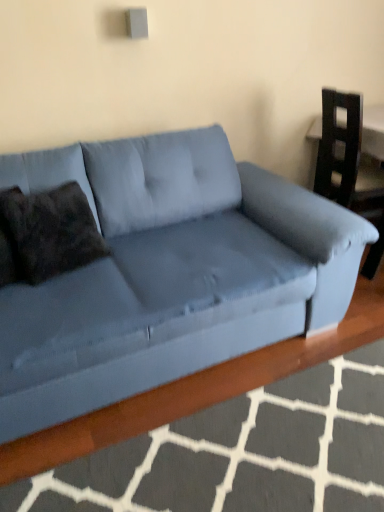
The image size is (384, 512). What do you see at coordinates (168, 273) in the screenshot? I see `velvet blue couch at center` at bounding box center [168, 273].

Describe the element at coordinates (46, 234) in the screenshot. I see `dark brown textured pillow at left` at that location.

Identify the location of matte blue armchair at right. (348, 167).

Considering the relative sizes of dark brown textured pillow at left and velvet blue couch at center in the image provided, is dark brown textured pillow at left bigger than velvet blue couch at center?

Result: Actually, dark brown textured pillow at left might be smaller than velvet blue couch at center.

From a real-world perspective, is dark brown textured pillow at left physically above velvet blue couch at center?

Yes, from a real-world perspective, dark brown textured pillow at left is on top of velvet blue couch at center.

Is point (43, 232) positioned before point (242, 251)?

Yes, it is.

Where is `pillow on the left of the velvet blue couch at center`? The width and height of the screenshot is (384, 512). pillow on the left of the velvet blue couch at center is located at coordinates (46, 234).

Is point (377, 245) positioned after point (13, 240)?

Yes, it is behind point (13, 240).

In terms of width, does matte blue armchair at right look wider or thinner when compared to dark brown textured pillow at left?

Considering their sizes, matte blue armchair at right looks broader than dark brown textured pillow at left.

How distant is matte blue armchair at right from dark brown textured pillow at left?

They are 1.60 meters apart.

From a real-world perspective, is matte blue armchair at right on dark brown textured pillow at left?

No.

In the scene shown: What's the angular difference between velvet blue couch at center and dark brown textured pillow at left's facing directions?

14.4 degrees separate the facing orientations of velvet blue couch at center and dark brown textured pillow at left.

Is velvet blue couch at center at the right side of dark brown textured pillow at left?

Yes, velvet blue couch at center is to the right of dark brown textured pillow at left.

Considering the relative sizes of velvet blue couch at center and dark brown textured pillow at left in the image provided, is velvet blue couch at center shorter than dark brown textured pillow at left?

No.

Would you say dark brown textured pillow at left is inside or outside matte blue armchair at right?

dark brown textured pillow at left is not enclosed by matte blue armchair at right.

Is dark brown textured pillow at left not close to matte blue armchair at right?

Yes, dark brown textured pillow at left is far from matte blue armchair at right.

Is dark brown textured pillow at left shorter than matte blue armchair at right?

Yes.

Does matte blue armchair at right have a greater width compared to velvet blue couch at center?

Incorrect, the width of matte blue armchair at right does not surpass that of velvet blue couch at center.

Is matte blue armchair at right facing towards velvet blue couch at center?

No, matte blue armchair at right is not oriented towards velvet blue couch at center.

From the image's perspective, does matte blue armchair at right appear higher than velvet blue couch at center?

Yes.

How much distance is there between matte blue armchair at right and velvet blue couch at center?

A distance of 36.87 inches exists between matte blue armchair at right and velvet blue couch at center.

Between velvet blue couch at center and matte blue armchair at right, which one is positioned in front?

velvet blue couch at center is closer to the camera.

Is velvet blue couch at center with matte blue armchair at right?

There is a gap between velvet blue couch at center and matte blue armchair at right.

Locate an element on the screen. The height and width of the screenshot is (512, 384). pillow above the velvet blue couch at center (from a real-world perspective) is located at coordinates (46, 234).

Where is `armchair above the dark brown textured pillow at left (from the image's perspective)`? armchair above the dark brown textured pillow at left (from the image's perspective) is located at coordinates (348, 167).

From the image, which object appears to be farther from matte blue armchair at right, velvet blue couch at center or dark brown textured pillow at left?

dark brown textured pillow at left lies further to matte blue armchair at right than the other object.

When comparing their distances from velvet blue couch at center, does matte blue armchair at right or dark brown textured pillow at left seem further?

matte blue armchair at right.

Estimate the real-world distances between objects in this image. Which object is closer to dark brown textured pillow at left, velvet blue couch at center or matte blue armchair at right?

Based on the image, velvet blue couch at center appears to be nearer to dark brown textured pillow at left.

Considering their positions, is dark brown textured pillow at left positioned closer to velvet blue couch at center than matte blue armchair at right?

dark brown textured pillow at left.

In the scene shown: When comparing their distances from dark brown textured pillow at left, does matte blue armchair at right or velvet blue couch at center seem closer?

Among the two, velvet blue couch at center is located nearer to dark brown textured pillow at left.

Looking at the image, which one is located further to matte blue armchair at right, dark brown textured pillow at left or velvet blue couch at center?

The object further to matte blue armchair at right is dark brown textured pillow at left.

The height and width of the screenshot is (512, 384). I want to click on studio couch between dark brown textured pillow at left and matte blue armchair at right, so click(168, 273).